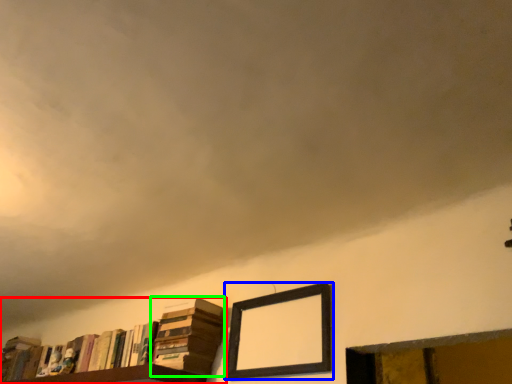
Question: Which is nearer to the book (highlighted by a red box)? picture frame (highlighted by a blue box) or book (highlighted by a green box).

Choices:
 (A) picture frame
 (B) book

Answer: (B)